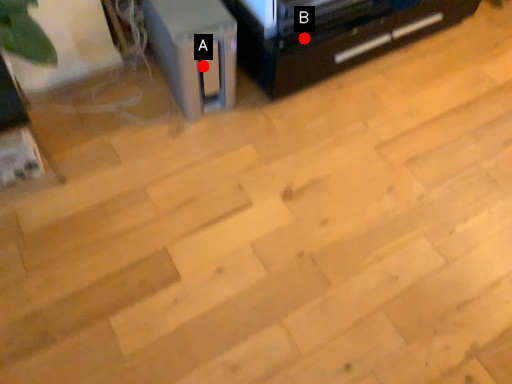
Question: Two points are circled on the image, labeled by A and B beside each circle. Which point appears closest to the camera in this image?

Choices:
 (A) A is closer
 (B) B is closer

Answer: (A)